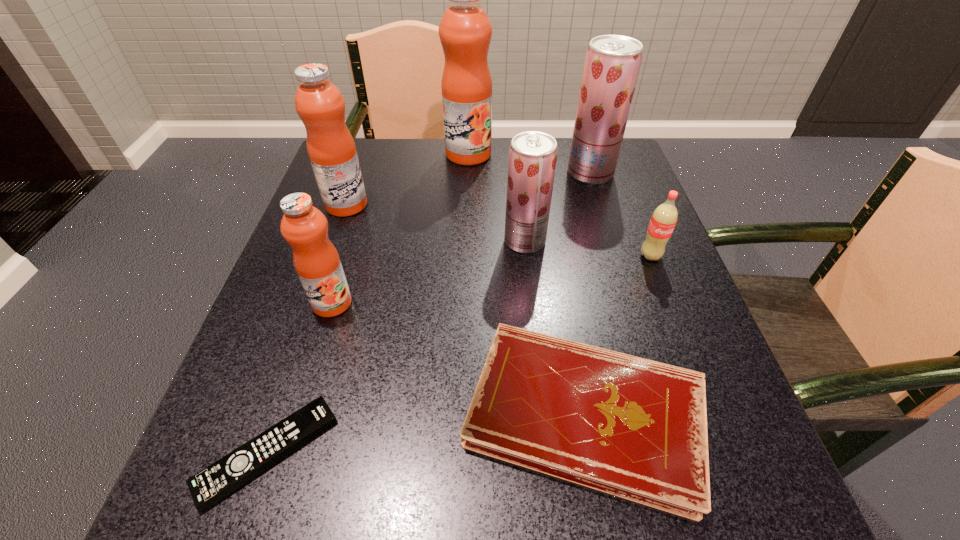
This screenshot has width=960, height=540. What are the coordinates of `free space between the shortest object and the notebook` in the screenshot? It's located at (426, 433).

Locate an element on the screen. Image resolution: width=960 pixels, height=540 pixels. vacant area that lies between the notebook and the smaller strawberry fruit juice is located at coordinates (555, 327).

You are a GUI agent. You are given a task and a screenshot of the screen. Output one action in this format:
    pyautogui.click(x=<x>, y=<y>)
    Task: Click on the vacant area that lies between the third fruit juice from right to left and the third farthest object
    Image resolution: width=960 pixels, height=540 pixels.
    Given the screenshot: What is the action you would take?
    pyautogui.click(x=407, y=179)

The height and width of the screenshot is (540, 960). I want to click on unoccupied area between the notebook and the third nearest object, so [459, 358].

This screenshot has width=960, height=540. In order to click on empty location between the seventh tallest object and the red soda in this screenshot , I will do `click(618, 334)`.

I want to click on free spot between the remote control and the smaller strawberry fruit juice, so click(x=396, y=347).

Locate an element on the screen. This screenshot has width=960, height=540. vacant region between the remote control and the third nearest object is located at coordinates (x=300, y=377).

The width and height of the screenshot is (960, 540). I want to click on object that can be found as the seventh closest to the second shortest object, so click(x=465, y=31).

Identify which object is the sixth closest to the second biggest orange fruit juice. Please provide its 2D coordinates. Your answer should be formatted as a tuple, i.e. [(x, y)], where the tuple contains the x and y coordinates of a point satisfying the conditions above.

[(612, 63)]

Select which fruit juice appears as the closest to the second nearest orange fruit juice. Please provide its 2D coordinates. Your answer should be formatted as a tuple, i.e. [(x, y)], where the tuple contains the x and y coordinates of a point satisfying the conditions above.

[(465, 31)]